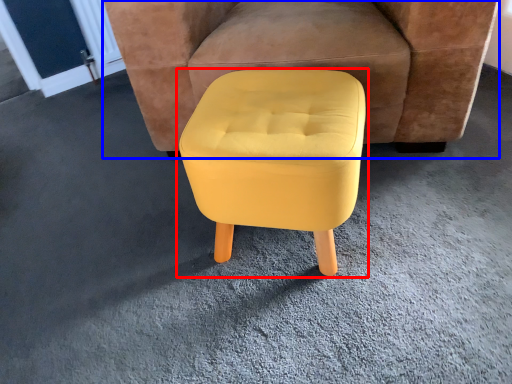
Question: Which object appears farthest to the camera in this image, stool (highlighted by a red box) or chair (highlighted by a blue box)?

Choices:
 (A) stool
 (B) chair

Answer: (B)